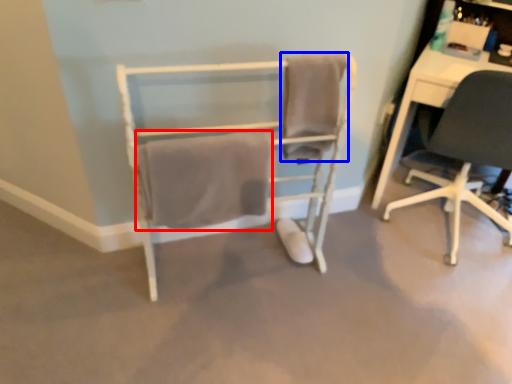
Question: Which of the following is the farthest to the observer, bath towel (highlighted by a red box) or bath towel (highlighted by a blue box)?

Choices:
 (A) bath towel
 (B) bath towel

Answer: (B)